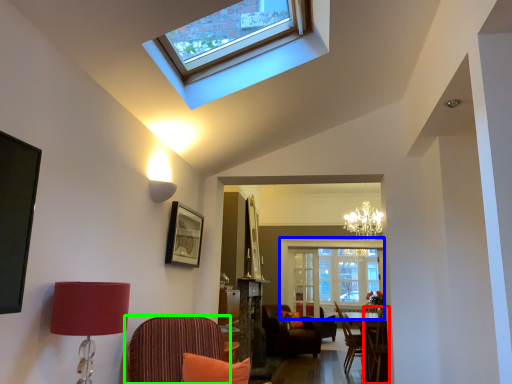
Question: Based on their relative distances, which object is nearer to chair (highlighted by a red box)? Choose from window screen (highlighted by a blue box) and chair (highlighted by a green box).

Choices:
 (A) window screen
 (B) chair

Answer: (B)